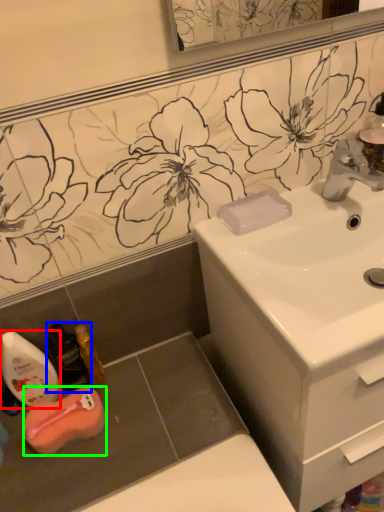
Question: Which is nearer to the mouthwash (highlighted by a red box)? mouthwash (highlighted by a blue box) or chiffonier (highlighted by a green box).

Choices:
 (A) mouthwash
 (B) chiffonier

Answer: (A)